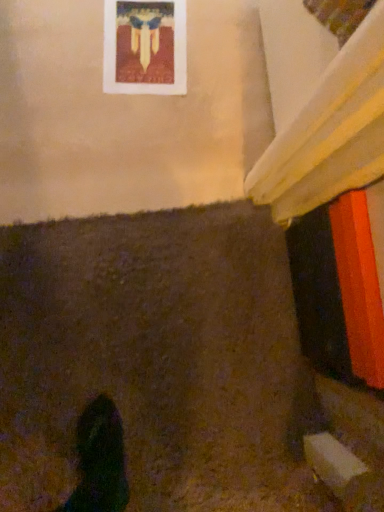
Find the location of a particular element. This screenshot has width=384, height=512. free location to the right of matte paper picture frame at upper center is located at coordinates (206, 97).